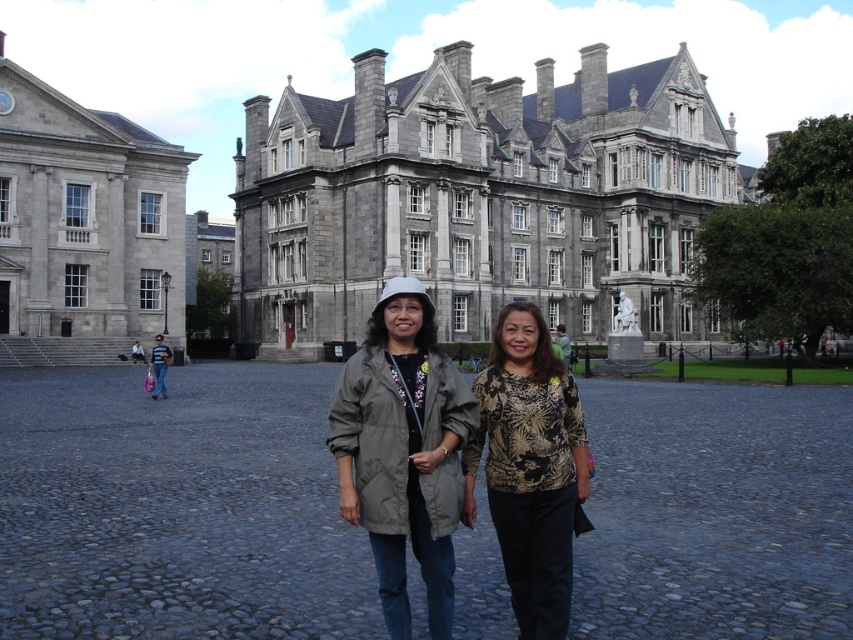
Based on the photo, is matte gray coat at center to the left of printed fabric blouse at center from the viewer's perspective?

Indeed, matte gray coat at center is positioned on the left side of printed fabric blouse at center.

Is matte gray coat at center wider than printed fabric blouse at center?

Indeed, matte gray coat at center has a greater width compared to printed fabric blouse at center.

Is point (402, 392) more distant than point (496, 422)?

No, it is in front of (496, 422).

Where is `matte gray coat at center`? Image resolution: width=853 pixels, height=640 pixels. matte gray coat at center is located at coordinates (403, 451).

Between gray stone building at center and gray stone building at left, which one appears on the left side from the viewer's perspective?

gray stone building at left is more to the left.

Can you confirm if gray stone building at center is thinner than gray stone building at left?

No.

Which is in front, point (601, 148) or point (16, 337)?

Point (16, 337)

Image resolution: width=853 pixels, height=640 pixels. Find the location of `gray stone building at center`. gray stone building at center is located at coordinates (479, 196).

Who is positioned more to the right, gray stone building at left or printed fabric blouse at center?

printed fabric blouse at center

In the scene shown: How far apart are gray stone building at left and printed fabric blouse at center?

45.09 meters

Which is in front, point (167, 186) or point (564, 442)?

Point (564, 442)

The image size is (853, 640). In order to click on gray stone building at left in this screenshot , I will do `click(84, 227)`.